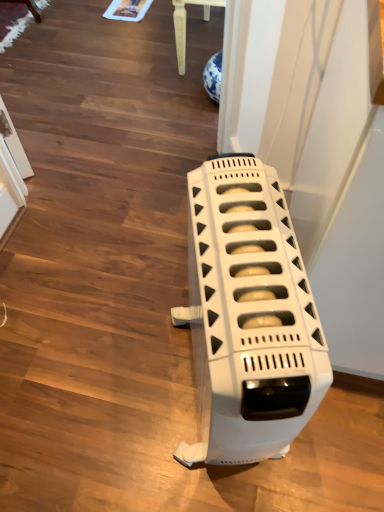
Locate an element on the screen. vacant space to the right of white glossy radiator at center is located at coordinates (341, 437).